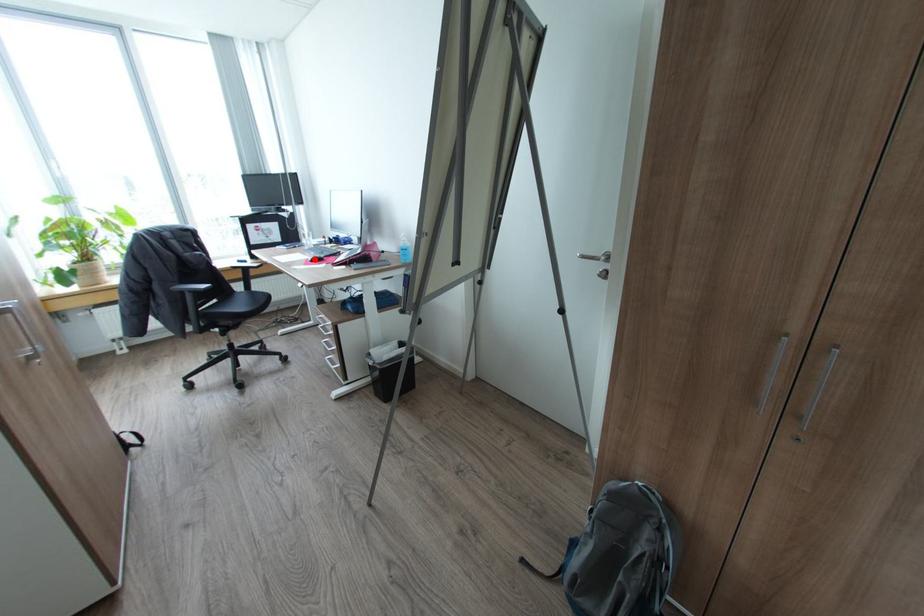
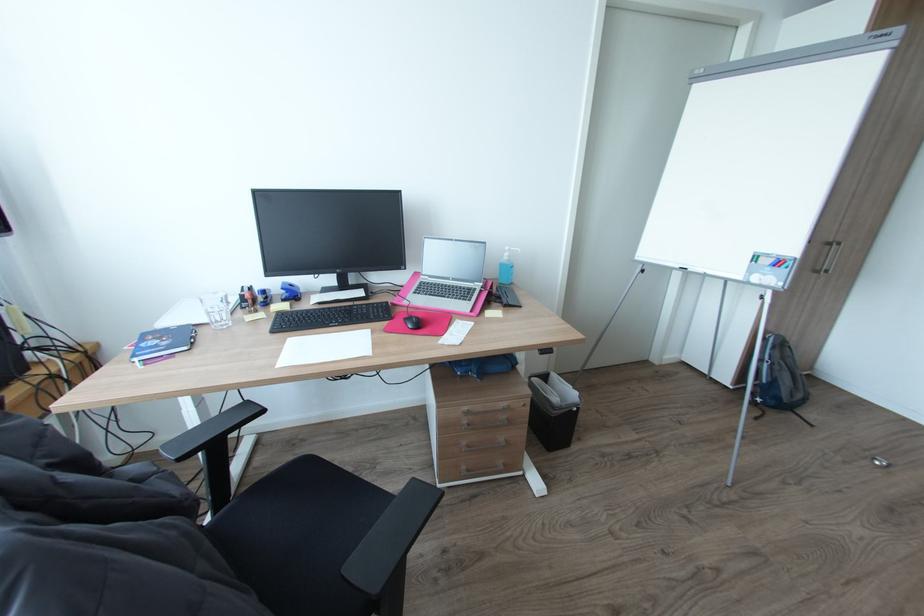
Locate, in the second image, the point that corresponds to the highlighted location in the first image.

(417, 326)